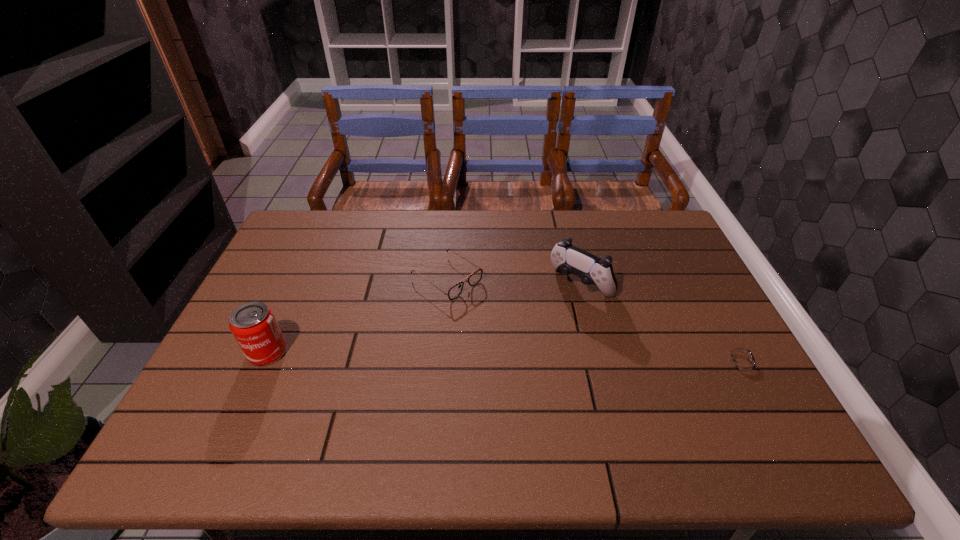
The image size is (960, 540). In order to click on vacant spot on the desktop that is between the can and the rightmost object and is positioned on the front-facing side of the control in this screenshot , I will do `click(512, 356)`.

Where is `free space on the desktop that is between the leftmost object and the watch and is positioned on the front-facing side of the second object from left to right`? free space on the desktop that is between the leftmost object and the watch and is positioned on the front-facing side of the second object from left to right is located at coordinates [x=560, y=357].